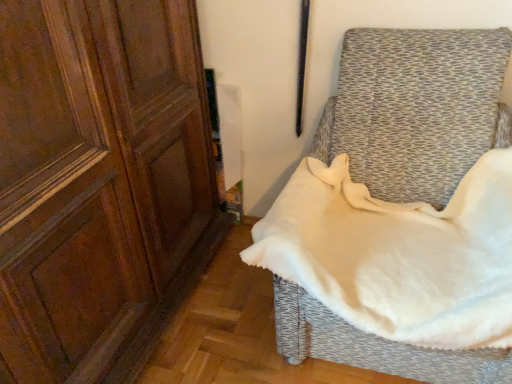
In the scene shown: In order to face white soft fabric at right, should I rotate leftwards or rightwards?

Turn right by 18.764 degrees to look at white soft fabric at right.

The height and width of the screenshot is (384, 512). In order to click on white soft fabric at right in this screenshot , I will do `click(416, 109)`.

Describe the element at coordinates (416, 109) in the screenshot. This screenshot has width=512, height=384. I see `white soft fabric at right` at that location.

Identify the location of matte wood screen door at left. (100, 184).

This screenshot has height=384, width=512. What do you see at coordinates (100, 184) in the screenshot?
I see `matte wood screen door at left` at bounding box center [100, 184].

Where is `white soft fabric at right`? This screenshot has width=512, height=384. white soft fabric at right is located at coordinates (416, 109).

Is matte wood screen door at left to the left of white soft fabric at right from the viewer's perspective?

Yes.

Is matte wood screen door at left in front of or behind white soft fabric at right in the image?

Visually, matte wood screen door at left is located in front of white soft fabric at right.

Is point (80, 116) positioned before point (372, 132)?

Yes.

Looking at this image, from the image's perspective, is matte wood screen door at left on white soft fabric at right?

Yes, from the image's perspective, matte wood screen door at left is above white soft fabric at right.

From a real-world perspective, is matte wood screen door at left positioned above or below white soft fabric at right?

matte wood screen door at left is situated higher than white soft fabric at right in the real world.

Considering the relative sizes of matte wood screen door at left and white soft fabric at right in the image provided, is matte wood screen door at left thinner than white soft fabric at right?

Indeed, matte wood screen door at left has a lesser width compared to white soft fabric at right.

Looking at this image, is matte wood screen door at left shorter than white soft fabric at right?

No.

In the scene shown: Can you confirm if matte wood screen door at left is smaller than white soft fabric at right?

Actually, matte wood screen door at left might be larger than white soft fabric at right.

Is matte wood screen door at left spatially inside white soft fabric at right, or outside of it?

matte wood screen door at left is located beyond the bounds of white soft fabric at right.

Can you see matte wood screen door at left touching white soft fabric at right?

No.

Is matte wood screen door at left facing away from white soft fabric at right?

No, matte wood screen door at left's orientation is not away from white soft fabric at right.

From the picture: Can you tell me how much matte wood screen door at left and white soft fabric at right differ in facing direction?

87.5 degrees separate the facing orientations of matte wood screen door at left and white soft fabric at right.

Identify the location of furniture on the right of the matte wood screen door at left. (416, 109).

Can you confirm if white soft fabric at right is positioned to the right of matte wood screen door at left?

Yes, white soft fabric at right is to the right of matte wood screen door at left.

Between white soft fabric at right and matte wood screen door at left, which one is positioned in front?

Positioned in front is matte wood screen door at left.

Is point (422, 166) farther from camera compared to point (16, 373)?

That is True.

From the image's perspective, relative to matte wood screen door at left, is white soft fabric at right above or below?

white soft fabric at right is below matte wood screen door at left.

From a real-world perspective, relative to matte wood screen door at left, is white soft fabric at right vertically above or below?

In terms of real-world spatial position, white soft fabric at right is below matte wood screen door at left.

In terms of width, does white soft fabric at right look wider or thinner when compared to matte wood screen door at left?

Considering their sizes, white soft fabric at right looks broader than matte wood screen door at left.

Can you confirm if white soft fabric at right is taller than matte wood screen door at left?

In fact, white soft fabric at right may be shorter than matte wood screen door at left.

Can you confirm if white soft fabric at right is bigger than matte wood screen door at left?

Actually, white soft fabric at right might be smaller than matte wood screen door at left.

Is white soft fabric at right not within matte wood screen door at left?

white soft fabric at right lies outside matte wood screen door at left's area.

Is white soft fabric at right positioned far away from matte wood screen door at left?

No, white soft fabric at right is not far from matte wood screen door at left.

From the picture: Is white soft fabric at right positioned with its back to matte wood screen door at left?

No, white soft fabric at right's orientation is not away from matte wood screen door at left.

From the picture: How many degrees apart are the facing directions of white soft fabric at right and matte wood screen door at left?

white soft fabric at right and matte wood screen door at left are facing 87.5 degrees away from each other.

Identify the location of screen door in front of the white soft fabric at right. The height and width of the screenshot is (384, 512). (100, 184).

This screenshot has height=384, width=512. In order to click on screen door that appears on the left of white soft fabric at right in this screenshot , I will do `click(100, 184)`.

In the image, there is a matte wood screen door at left. Where is `furniture below it (from the image's perspective)`? This screenshot has width=512, height=384. furniture below it (from the image's perspective) is located at coordinates (416, 109).